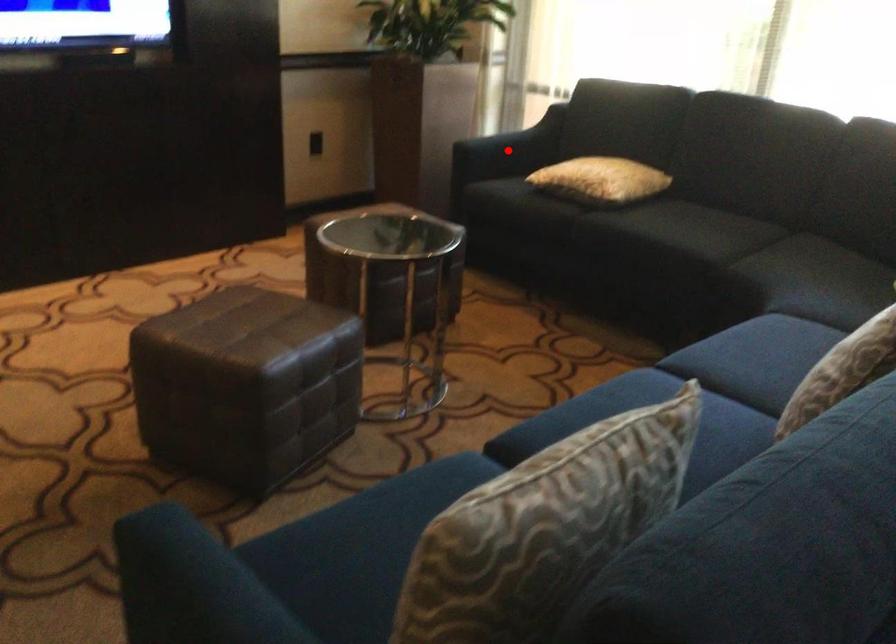
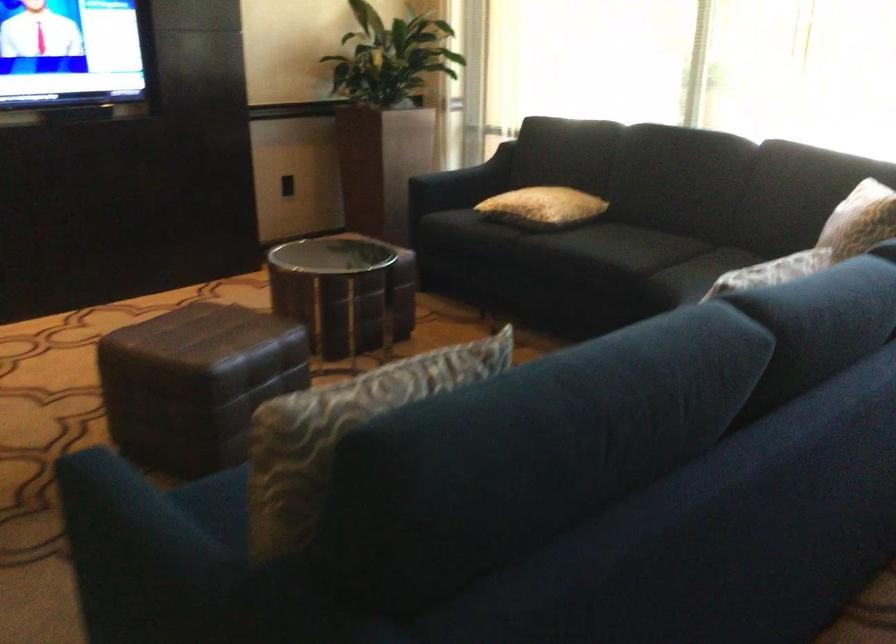
Where in the second image is the point corresponding to the highlighted location from the first image?

(460, 184)